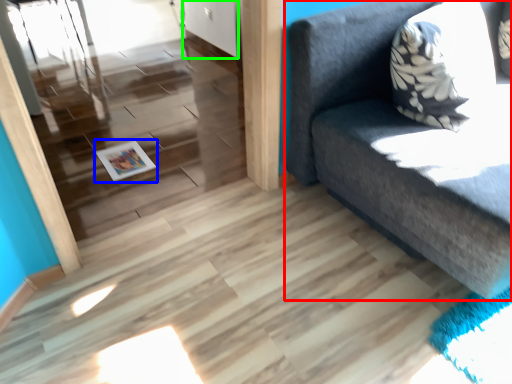
Question: Which is nearer to the studio couch (highlighted by a red box)? magazine (highlighted by a blue box) or door (highlighted by a green box).

Choices:
 (A) magazine
 (B) door

Answer: (A)